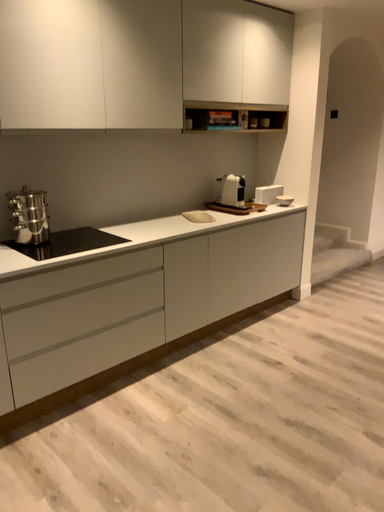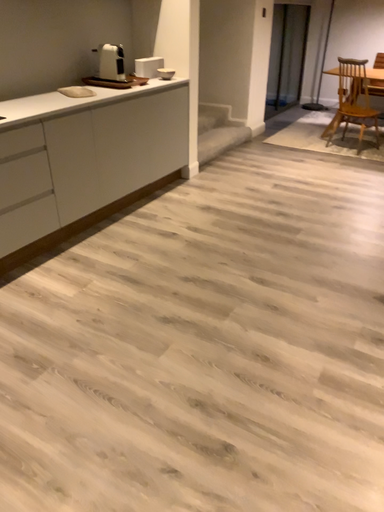
Question: Which way did the camera rotate in the video?

Choices:
 (A) rotated right
 (B) rotated left

Answer: (A)